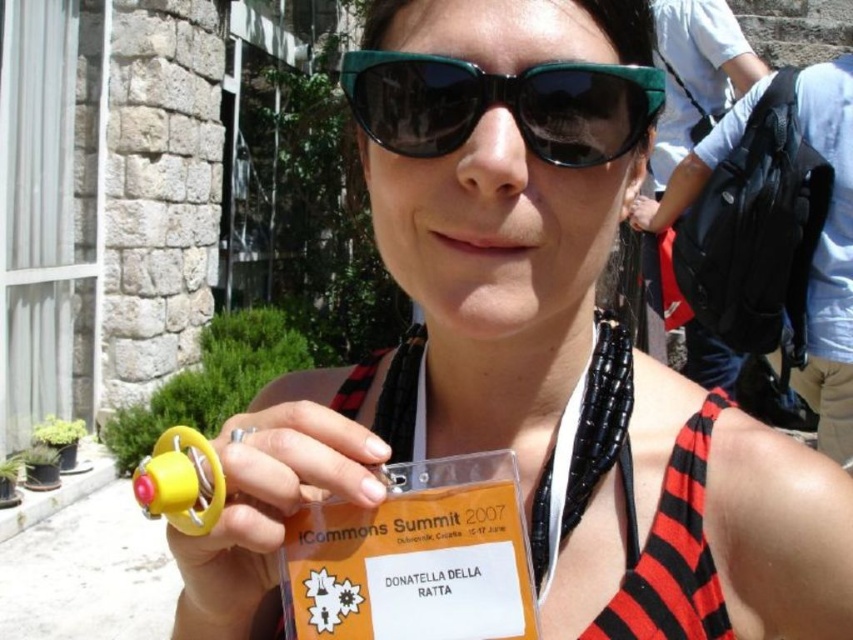
Question: Is green plastic sunglasses at center closer to camera compared to yellow rubber ring at lower left?

Choices:
 (A) no
 (B) yes

Answer: (A)

Question: Can you confirm if black beaded lanyard at center is positioned below red striped bikini top at center?

Choices:
 (A) yes
 (B) no

Answer: (B)

Question: Which point is farther from the camera taking this photo?

Choices:
 (A) (340, 426)
 (B) (712, 634)
 (C) (534, 564)
 (D) (437, 92)

Answer: (B)

Question: Among these objects, which one is farthest from the camera?

Choices:
 (A) black beaded lanyard at center
 (B) yellow rubber ring at lower left
 (C) green plastic sunglasses at center

Answer: (C)

Question: Can you confirm if yellow rubber ring at lower left is smaller than red striped bikini top at center?

Choices:
 (A) no
 (B) yes

Answer: (A)

Question: Which object is closer to the camera taking this photo?

Choices:
 (A) black beaded lanyard at center
 (B) red striped bikini top at center

Answer: (A)